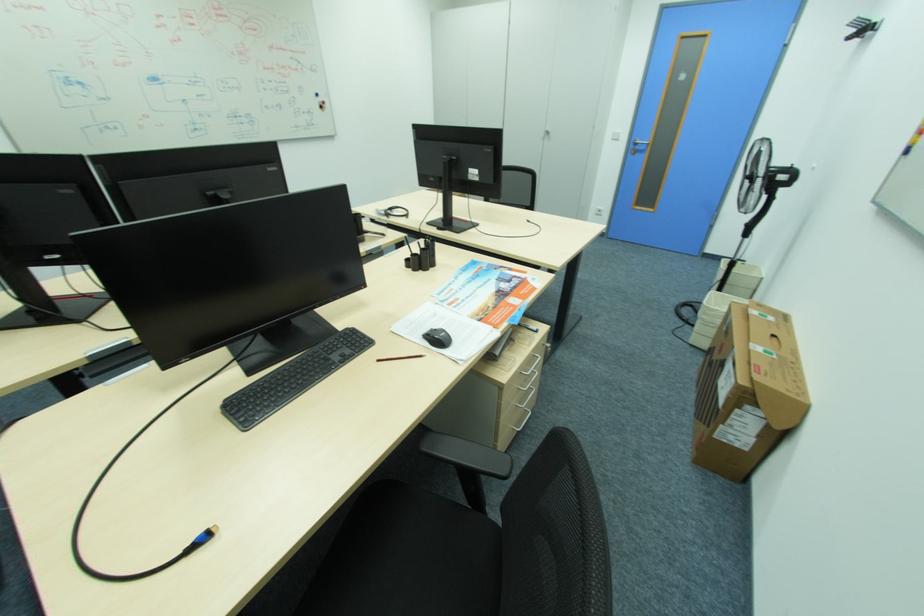
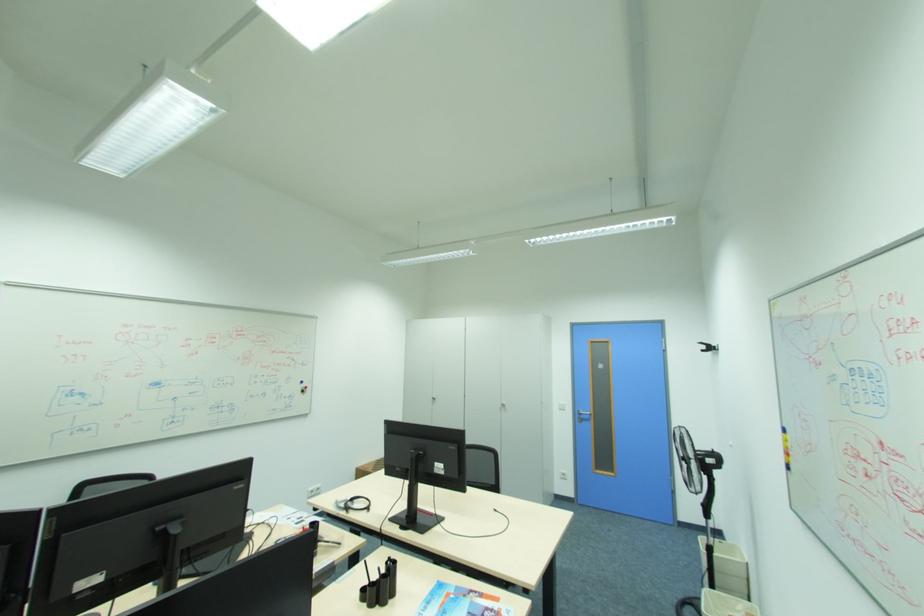
In the second image, find the point that corresponds to pixel 424 244 in the first image.

(383, 570)